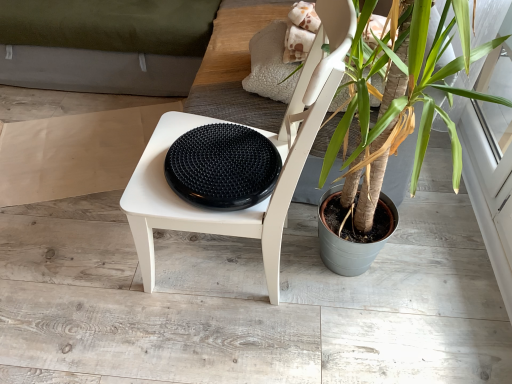
Question: Based on their sizes in the image, would you say beige paper at left is bigger or smaller than white matte chair at center?

Choices:
 (A) small
 (B) big

Answer: (A)

Question: From a real-world perspective, is beige paper at left physically located above or below white matte chair at center?

Choices:
 (A) below
 (B) above

Answer: (A)

Question: Estimate the real-world distances between objects in this image. Which object is farther from the white matte chair at center?

Choices:
 (A) beige paper at left
 (B) green leafy plant at center
 (C) black rubber disc at center

Answer: (A)

Question: Estimate the real-world distances between objects in this image. Which object is farther from the white matte chair at center?

Choices:
 (A) black rubber disc at center
 (B) beige paper at left
 (C) green leafy plant at center

Answer: (B)